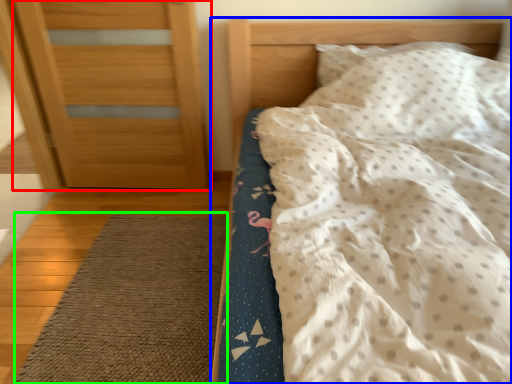
Question: Based on their relative distances, which object is farther from door (highlighted by a red box)? Choose from bed (highlighted by a blue box) and doormat (highlighted by a green box).

Choices:
 (A) bed
 (B) doormat

Answer: (B)